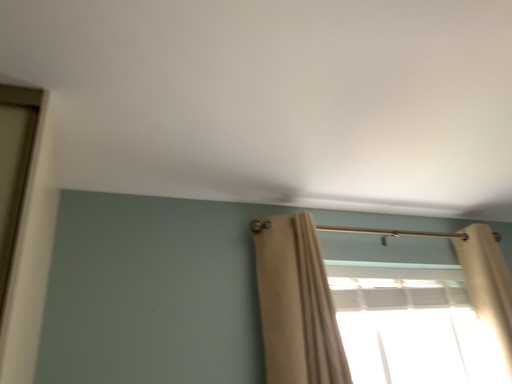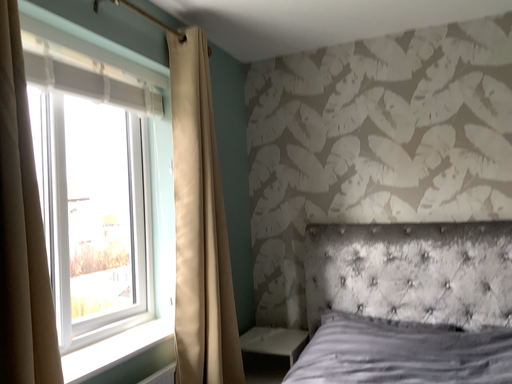
Question: How did the camera likely rotate when shooting the video?

Choices:
 (A) rotated left
 (B) rotated right

Answer: (B)